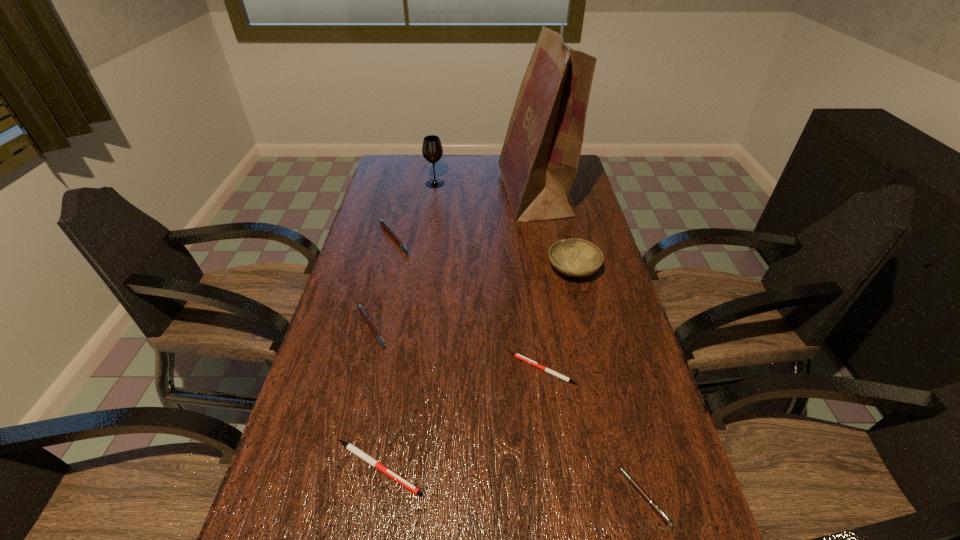
Find the location of a particular element. wineglass that is positioned at the far edge is located at coordinates [432, 150].

Identify the location of grocery bag that is at the right edge. click(x=539, y=161).

Image resolution: width=960 pixels, height=540 pixels. In order to click on bowl at the right edge in this screenshot , I will do `click(575, 257)`.

You are a GUI agent. You are given a task and a screenshot of the screen. Output one action in this format:
    pyautogui.click(x=<x>, y=<y>)
    Task: Click on the pen present at the right edge
    This screenshot has width=960, height=540.
    Given the screenshot: What is the action you would take?
    pyautogui.click(x=656, y=508)

Locate an element on the screen. The height and width of the screenshot is (540, 960). object that is at the far right corner is located at coordinates (539, 161).

Identify the location of vacant space at the far edge of the desktop. The image size is (960, 540). (493, 166).

Locate an element on the screen. vacant space at the left edge is located at coordinates (382, 338).

This screenshot has width=960, height=540. Identify the location of free space at the right edge. (592, 240).

This screenshot has height=540, width=960. Find the location of `blank space at the far left corner of the desktop`. blank space at the far left corner of the desktop is located at coordinates (412, 177).

I want to click on unoccupied area between the nearest pink pen and the third nearest object, so click(594, 433).